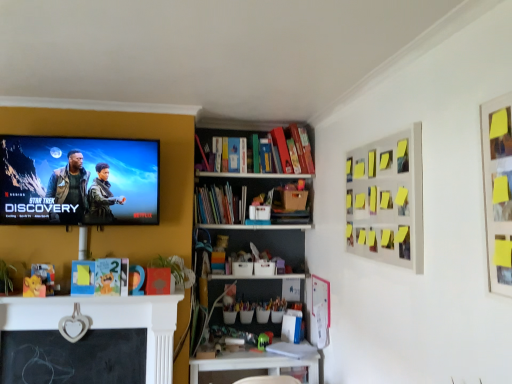
Where is `white plastic table at lower center`? white plastic table at lower center is located at coordinates (252, 366).

From the picture: What is the approximate width of yellow sticky notes at upper right?

2.74 inches.

I want to click on matte black screen at upper left, so click(78, 181).

The width and height of the screenshot is (512, 384). What do you see at coordinates (78, 181) in the screenshot?
I see `matte black screen at upper left` at bounding box center [78, 181].

You are a GUI agent. You are given a task and a screenshot of the screen. Output one action in this format:
    pyautogui.click(x=<x>, y=<y>)
    Task: Click on the green plastic toy at lower center
    The image size is (512, 384).
    Given the screenshot: What is the action you would take?
    pyautogui.click(x=264, y=340)

In order to click on white plastic table at lower center in this screenshot , I will do 252,366.

Who is smaller, yellow sticky notes at upper right or hardcover book at center?

Smaller between the two is hardcover book at center.

Considering the relative sizes of yellow sticky notes at upper right and hardcover book at center in the image provided, is yellow sticky notes at upper right taller than hardcover book at center?

Indeed, yellow sticky notes at upper right has a greater height compared to hardcover book at center.

Is yellow sticky notes at upper right looking in the opposite direction of hardcover book at center?

No, yellow sticky notes at upper right is not facing away from hardcover book at center.

In the image, is green plastic toy at lower center positioned in front of or behind hardcover book at center?

green plastic toy at lower center is positioned closer to the viewer than hardcover book at center.

Between green plastic toy at lower center and hardcover book at center, which one has smaller size?

Smaller between the two is green plastic toy at lower center.

From a real-world perspective, is green plastic toy at lower center physically located above or below hardcover book at center?

From a real-world perspective, green plastic toy at lower center is physically below hardcover book at center.

Is green plastic toy at lower center facing away from hardcover book at center?

No.

Based on the photo, is white plastic table at lower center aimed at hardcover book at center?

No, white plastic table at lower center is not aimed at hardcover book at center.

At what (x,y) coordinates should I click in order to perform the action: click on book lying on the left of white plastic table at lower center. Please return your answer as a coordinate pair (x, y). The image size is (512, 384). Looking at the image, I should click on (219, 205).

Can you confirm if white plastic table at lower center is thinner than hardcover book at center?

No.

This screenshot has width=512, height=384. Identify the location of toy on the left of yellow sticky notes at upper right. (264, 340).

Relative to green plastic toy at lower center, is yellow sticky notes at upper right in front or behind?

Visually, yellow sticky notes at upper right is located in front of green plastic toy at lower center.

How many degrees apart are the facing directions of yellow sticky notes at upper right and green plastic toy at lower center?

yellow sticky notes at upper right and green plastic toy at lower center are facing 90 degrees away from each other.

Is yellow sticky notes at upper right touching green plastic toy at lower center?

No, yellow sticky notes at upper right is not touching green plastic toy at lower center.

Is hardcover book at center far away from white plastic table at lower center?

That's right, there is a large distance between hardcover book at center and white plastic table at lower center.

Is hardcover book at center in front of or behind white plastic table at lower center in the image?

In the image, hardcover book at center appears behind white plastic table at lower center.

From the picture: Considering the sizes of objects hardcover book at center and white plastic table at lower center in the image provided, who is taller, hardcover book at center or white plastic table at lower center?

white plastic table at lower center.

From the image's perspective, between hardcover book at center and white plastic table at lower center, which one is located above?

From the image's view, hardcover book at center is above.

Is the position of hardcover book at center more distant than that of matte black screen at upper left?

Yes.

Between hardcover book at center and matte black screen at upper left, which one has larger width?

hardcover book at center is wider.

What's the angular difference between hardcover book at center and matte black screen at upper left's facing directions?

8.17e-05 degrees.

From a real-world perspective, is hardcover book at center located higher than matte black screen at upper left?

No, from a real-world perspective, hardcover book at center is not over matte black screen at upper left

Where is `table on the left side of yellow sticky notes at upper right`? table on the left side of yellow sticky notes at upper right is located at coordinates (252, 366).

How much distance is there between yellow sticky notes at upper right and white plastic table at lower center?

The distance of yellow sticky notes at upper right from white plastic table at lower center is 1.41 meters.

Who is taller, yellow sticky notes at upper right or white plastic table at lower center?

yellow sticky notes at upper right.

Which is in front, yellow sticky notes at upper right or white plastic table at lower center?

yellow sticky notes at upper right.

You are a GUI agent. You are given a task and a screenshot of the screen. Output one action in this format:
    pyautogui.click(x=<x>, y=<y>)
    Task: Click on the bulletin board located above the hardcover book at center (from a real-world perspective)
    Image resolution: width=512 pixels, height=384 pixels.
    Given the screenshot: What is the action you would take?
    pyautogui.click(x=387, y=200)

I want to click on toy below the hardcover book at center (from the image's perspective), so click(264, 340).

Looking at the image, which one is located further to matte black screen at upper left, hardcover book at center or yellow sticky notes at upper right?

Among the two, yellow sticky notes at upper right is located further to matte black screen at upper left.

When comparing their distances from yellow sticky notes at upper right, does matte black screen at upper left or green plastic toy at lower center seem closer?

green plastic toy at lower center is closer to yellow sticky notes at upper right.

When comparing their distances from white plastic table at lower center, does matte black screen at upper left or hardcover book at center seem further?

matte black screen at upper left.

Considering their positions, is yellow sticky notes at upper right positioned closer to white plastic table at lower center than green plastic toy at lower center?

green plastic toy at lower center lies closer to white plastic table at lower center than the other object.

From the image, which object appears to be nearer to hardcover book at center, green plastic toy at lower center or matte black screen at upper left?

matte black screen at upper left.

Estimate the real-world distances between objects in this image. Which object is further from green plastic toy at lower center, matte black screen at upper left or hardcover book at center?

matte black screen at upper left lies further to green plastic toy at lower center than the other object.

Looking at the image, which one is located further to hardcover book at center, green plastic toy at lower center or white plastic table at lower center?

white plastic table at lower center.

Considering their positions, is hardcover book at center positioned further to green plastic toy at lower center than white plastic table at lower center?

hardcover book at center is positioned further to the anchor green plastic toy at lower center.

Find the location of a particular element. The image size is (512, 384). table situated between matte black screen at upper left and yellow sticky notes at upper right from left to right is located at coordinates (252, 366).

In order to click on toy between hardcover book at center and white plastic table at lower center in the vertical direction in this screenshot , I will do `click(264, 340)`.

Where is `toy between matte black screen at upper left and yellow sticky notes at upper right from left to right`? The height and width of the screenshot is (384, 512). toy between matte black screen at upper left and yellow sticky notes at upper right from left to right is located at coordinates (264, 340).

In order to click on book between matte black screen at upper left and yellow sticky notes at upper right from left to right in this screenshot , I will do `click(219, 205)`.